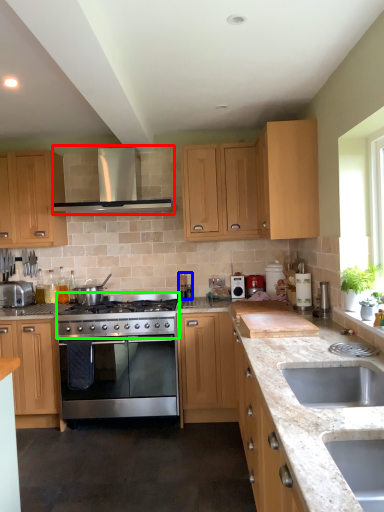
Question: Which object is positioned farthest from exhaust hood (highlighted by a red box)? Select from coffee machine (highlighted by a blue box) and gas stove (highlighted by a green box).

Choices:
 (A) coffee machine
 (B) gas stove

Answer: (A)